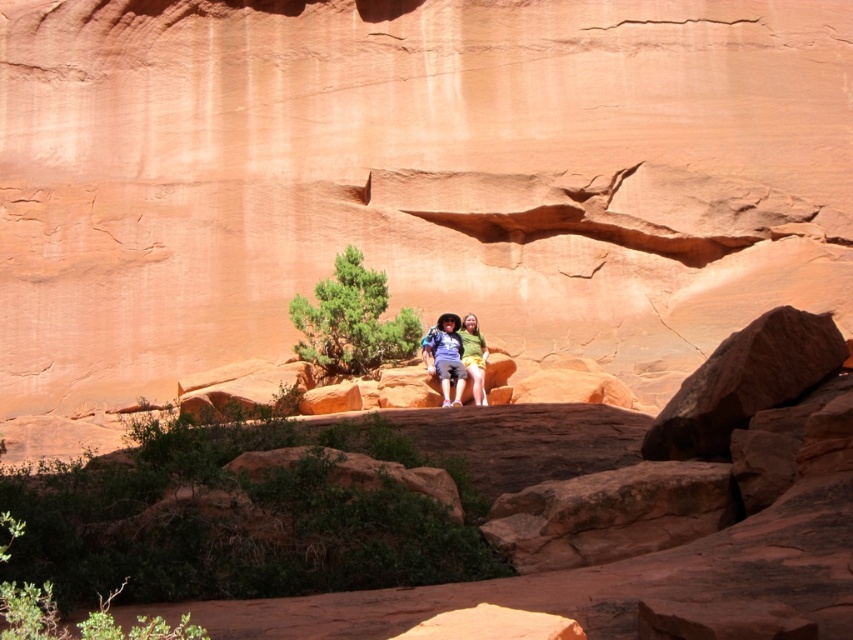
Between point (459, 346) and point (477, 372), which one is positioned in front?

Point (477, 372) is more forward.

Does point (445, 342) come in front of point (466, 353)?

No, it is not.

Identify the location of matte blue shorts at center. (445, 356).